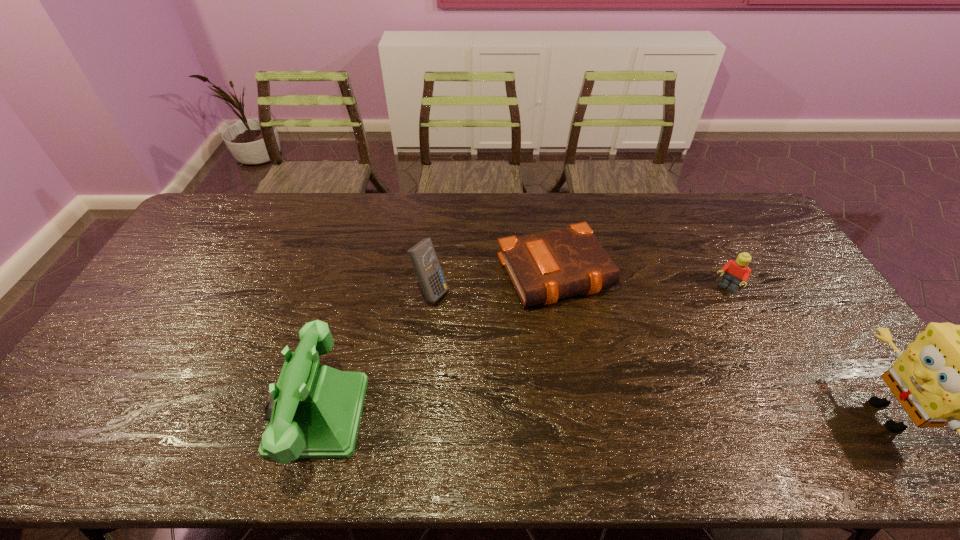
The image size is (960, 540). I want to click on blank space located 0.270m on the dial of the fourth shortest object, so click(162, 415).

You are a GUI agent. You are given a task and a screenshot of the screen. Output one action in this format:
    pyautogui.click(x=<x>, y=<y>)
    Task: Click on the vacant area situated 0.120m on the front-facing side of the calculator
    The width and height of the screenshot is (960, 540).
    Given the screenshot: What is the action you would take?
    (x=476, y=319)

The image size is (960, 540). What are the coordinates of `free region located on the front-facing side of the calculator` in the screenshot? It's located at (488, 325).

Identify the location of free space located on the front-facing side of the calculator. The height and width of the screenshot is (540, 960). (474, 317).

Where is `free space located on the face of the fourth tallest object`? The height and width of the screenshot is (540, 960). free space located on the face of the fourth tallest object is located at coordinates (672, 354).

You are a GUI agent. You are given a task and a screenshot of the screen. Output one action in this format:
    pyautogui.click(x=<x>, y=<y>)
    Task: Click on the vacant space situated 0.300m on the face of the fourth tallest object
    
    Given the screenshot: What is the action you would take?
    pyautogui.click(x=672, y=354)

Identify the location of free space located 0.210m on the face of the fourth tallest object. (688, 335).

This screenshot has height=540, width=960. What are the coordinates of `vacant region located 0.110m on the spine side of the shortest object` in the screenshot? It's located at (600, 341).

At what (x,y) coordinates should I click in order to perform the action: click on free region located on the spine side of the shortest object. Please return your answer as a coordinate pair (x, y). Image resolution: width=960 pixels, height=540 pixels. Looking at the image, I should click on (611, 358).

The image size is (960, 540). I want to click on vacant space located 0.280m on the spine side of the shortest object, so click(x=632, y=393).